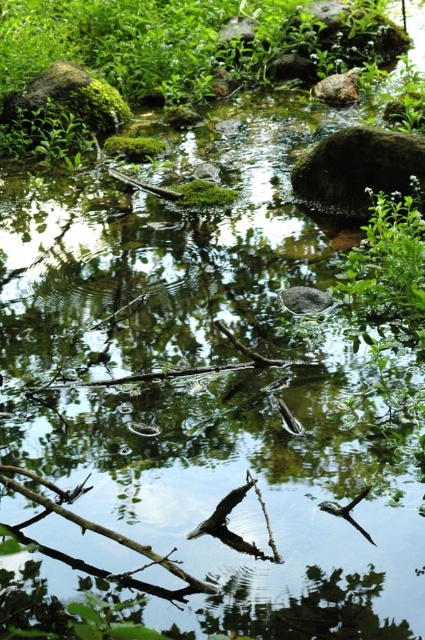
Question: Can you confirm if green mossy rock at upper right is positioned to the right of green mossy rock at upper left?

Choices:
 (A) no
 (B) yes

Answer: (B)

Question: Observing the image, what is the correct spatial positioning of green leafy plant at upper right in reference to green mossy rock at upper right?

Choices:
 (A) above
 (B) below

Answer: (B)

Question: Among these objects, which one is nearest to the camera?

Choices:
 (A) green mossy rock at upper right
 (B) green mossy rock at upper left
 (C) green leafy plant at upper right

Answer: (C)

Question: Can you confirm if green mossy rock at upper right is positioned to the right of green mossy rock at upper left?

Choices:
 (A) yes
 (B) no

Answer: (A)

Question: Considering the real-world distances, which object is closest to the green leafy plant at upper right?

Choices:
 (A) green mossy rock at upper right
 (B) green mossy rock at upper left

Answer: (A)

Question: Estimate the real-world distances between objects in this image. Which object is closer to the green mossy rock at upper left?

Choices:
 (A) green leafy plant at upper right
 (B) green mossy rock at upper right

Answer: (B)